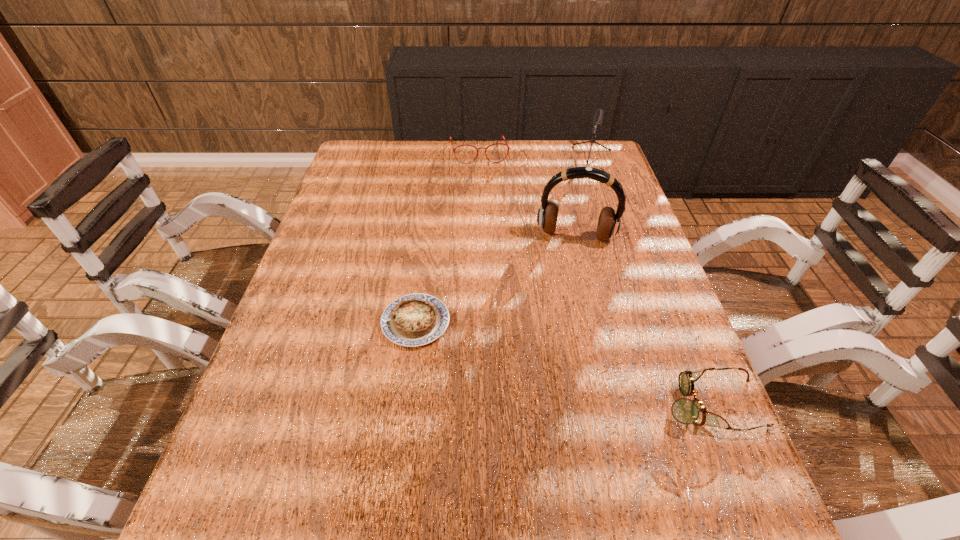
You are a GUI agent. You are given a task and a screenshot of the screen. Output one action in this format:
    pyautogui.click(x=<x>, y=<y>)
    Task: Click on the vacant spot on the desktop that is between the shortest object and the shorter spectacles and is positioned on the ear cup of the tallest object
    
    Given the screenshot: What is the action you would take?
    pyautogui.click(x=561, y=362)

The image size is (960, 540). What are the coordinates of `vacant space on the desktop that is between the shortest object and the nearest object and is positioned on the stand of the microphone` in the screenshot? It's located at (529, 354).

At what (x,y) coordinates should I click in order to perform the action: click on vacant space on the desktop that is between the second nearest object and the shorter spectacles and is positioned on the face of the farther spectacles. Please return your answer as a coordinate pair (x, y). The image size is (960, 540). Looking at the image, I should click on 517,350.